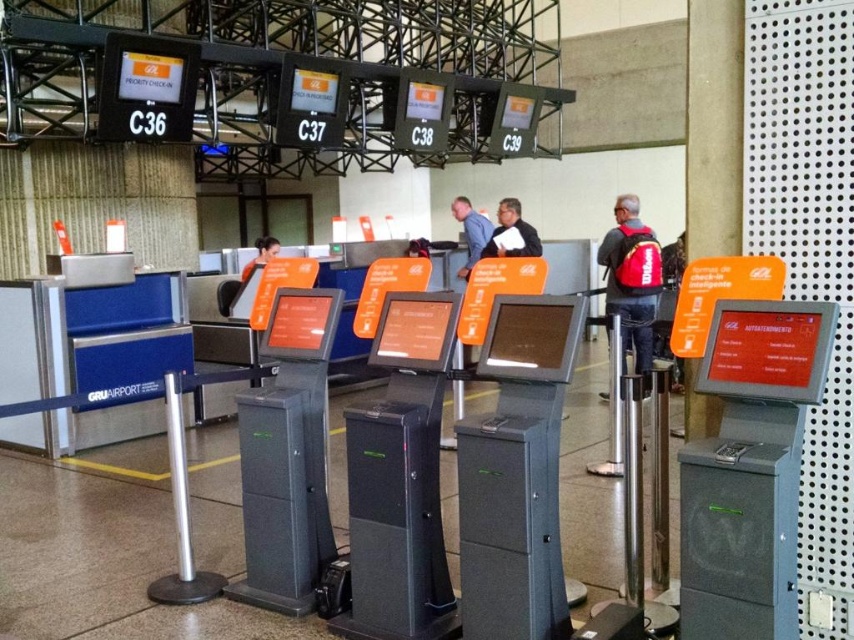
Question: Where is blue shirt at center located in relation to matte black jacket at center in the image?

Choices:
 (A) below
 (B) above

Answer: (B)

Question: Does red backpack at center appear under matte black jacket at center?

Choices:
 (A) no
 (B) yes

Answer: (B)

Question: Which of these objects is positioned closest to the matte black jacket at center?

Choices:
 (A) orange fabric shirt at center
 (B) red backpack at center

Answer: (B)

Question: Based on their relative distances, which object is nearer to the blue shirt at center?

Choices:
 (A) orange fabric shirt at center
 (B) red backpack at center
 (C) matte black jacket at center

Answer: (C)

Question: Is red backpack at center below matte black jacket at center?

Choices:
 (A) no
 (B) yes

Answer: (B)

Question: Among these objects, which one is nearest to the camera?

Choices:
 (A) orange fabric shirt at center
 (B) blue shirt at center
 (C) red backpack at center

Answer: (C)